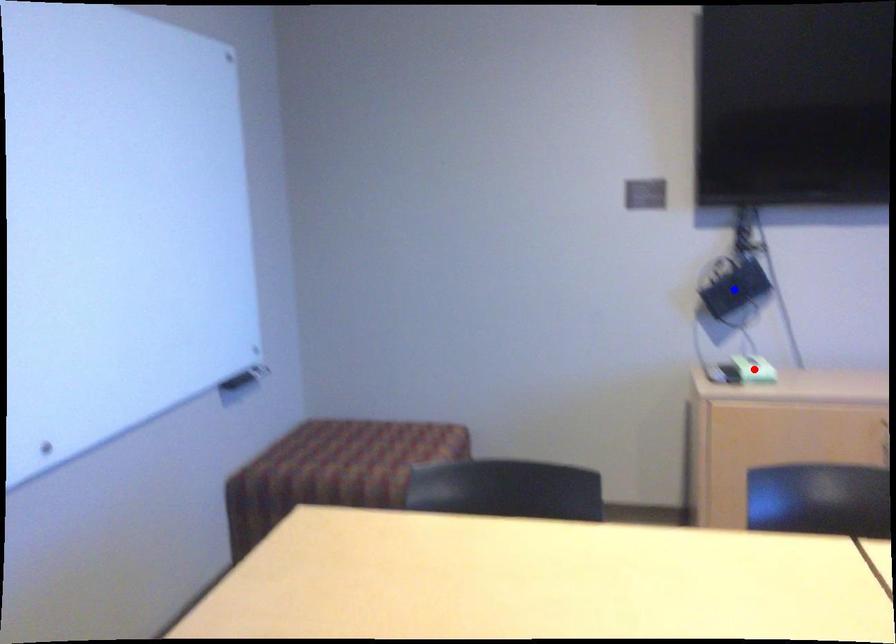
Question: In the image, two points are highlighted. Which point is nearer to the camera? Reply with the corresponding letter.

Choices:
 (A) blue point
 (B) red point

Answer: (B)